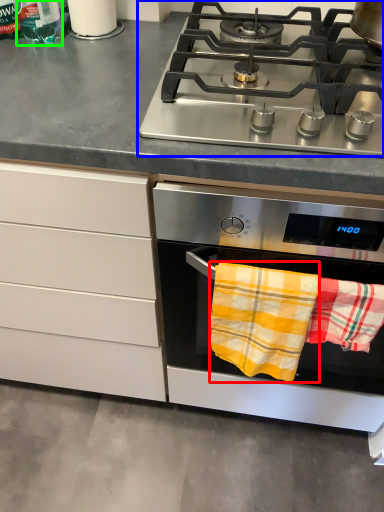
Question: Estimate the real-world distances between objects in this image. Which object is farther from beach towel (highlighted by a red box), gas stove (highlighted by a blue box) or bottle (highlighted by a green box)?

Choices:
 (A) gas stove
 (B) bottle

Answer: (B)